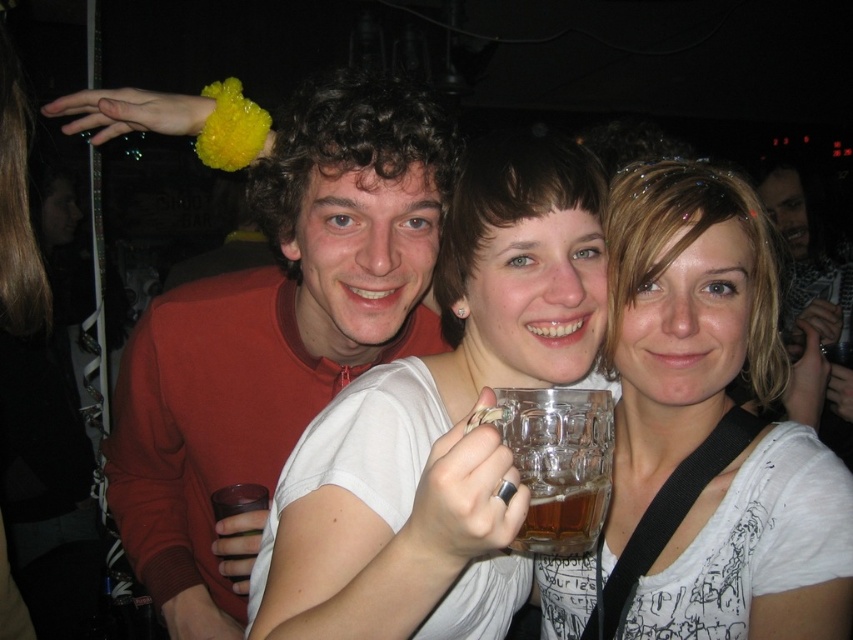
Does matte red sweater at center have a smaller size compared to matte white shirt at center?

Incorrect, matte red sweater at center is not smaller in size than matte white shirt at center.

Who is positioned more to the right, matte red sweater at center or matte white shirt at center?

matte white shirt at center

Which is behind, point (148, 448) or point (746, 346)?

The point (148, 448) is more distant.

I want to click on matte red sweater at center, so (x=276, y=336).

Between matte white shirt at center and transparent glass mug at center, which one has less height?

Standing shorter between the two is transparent glass mug at center.

Which is in front, point (688, 212) or point (467, 429)?

Point (467, 429)

Which is behind, point (755, 342) or point (515, 412)?

Point (755, 342)

Identify the location of matte white shirt at center. The image size is (853, 640). [x=705, y=429].

Does point (206, 580) come behind point (486, 196)?

Yes, point (206, 580) is behind point (486, 196).

Is point (209, 342) positioned before point (395, 412)?

No, (209, 342) is behind (395, 412).

Find the location of a particular element. The width and height of the screenshot is (853, 640). matte red sweater at center is located at coordinates (276, 336).